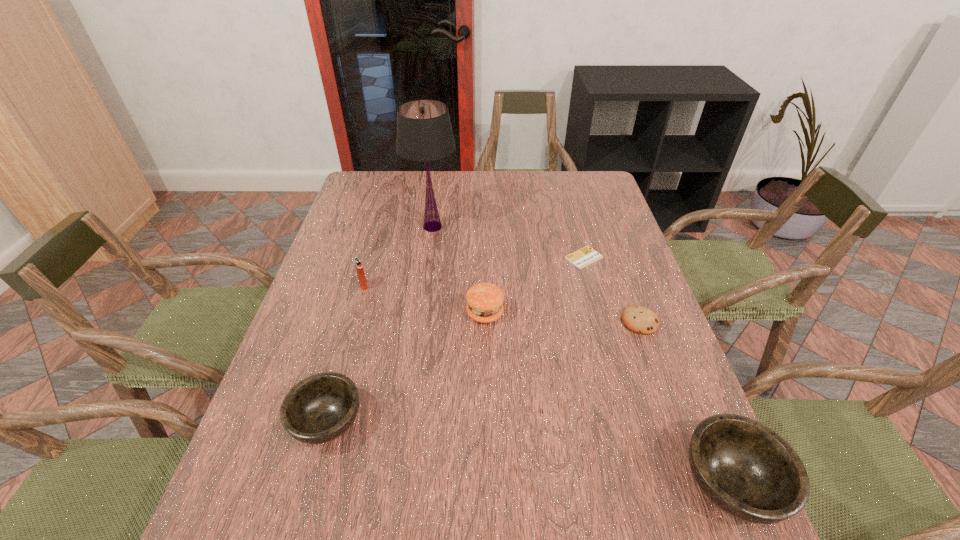
Please determine a free point for an extra bowl to ensure balance. Please provide its 2D coordinates. Your answer should be formatted as a tuple, i.e. [(x, y)], where the tuple contains the x and y coordinates of a point satisfying the conditions above.

[(518, 451)]